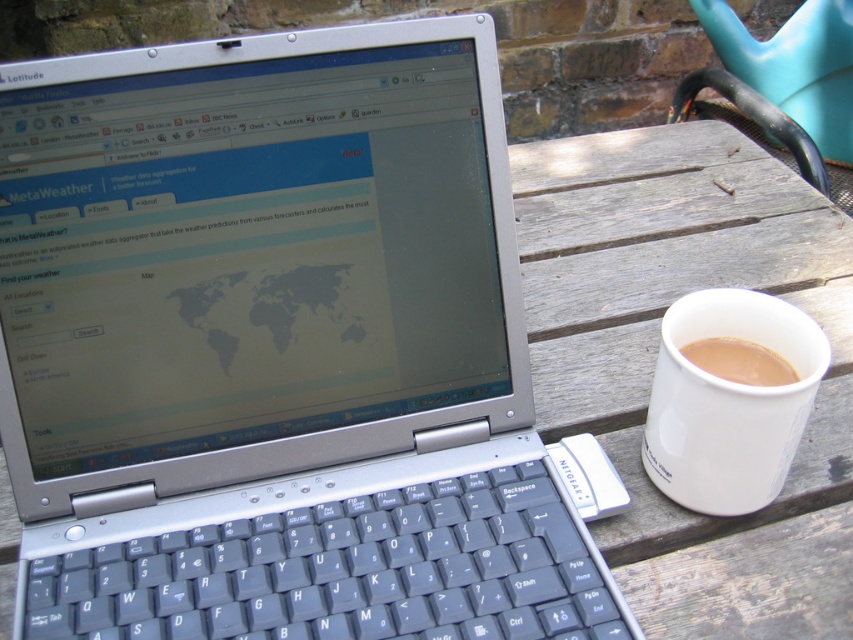
Is white ceramic mug at right to the right of white matte cup at right from the viewer's perspective?

Incorrect, white ceramic mug at right is not on the right side of white matte cup at right.

Is point (782, 332) in front of point (751, 369)?

No, (782, 332) is behind (751, 369).

You are a GUI agent. You are given a task and a screenshot of the screen. Output one action in this format:
    pyautogui.click(x=<x>, y=<y>)
    Task: Click on the white ceramic mug at right
    This screenshot has width=853, height=640.
    Given the screenshot: What is the action you would take?
    pyautogui.click(x=728, y=403)

Which is below, silver metallic laptop at center or white matte cup at right?

white matte cup at right

In the scene shown: Is silver metallic laptop at center positioned in front of white matte cup at right?

Yes, silver metallic laptop at center is closer to the viewer.

Is point (173, 593) positioned before point (697, 356)?

Yes.

At what (x,y) coordinates should I click in order to perform the action: click on silver metallic laptop at center. Please return your answer as a coordinate pair (x, y). This screenshot has width=853, height=640. Looking at the image, I should click on (277, 348).

Does point (485, 477) lie in front of point (759, 292)?

Yes, it is in front of point (759, 292).

Describe the element at coordinates (277, 348) in the screenshot. I see `silver metallic laptop at center` at that location.

Find the location of `silver metallic laptop at center`. silver metallic laptop at center is located at coordinates (277, 348).